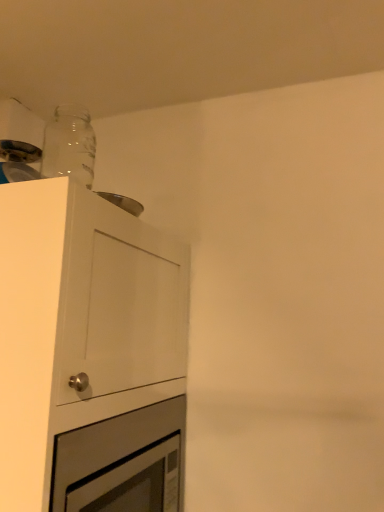
Question: Is the position of white matte cabinet at upper left less distant than that of silver metallic oven at lower left?

Choices:
 (A) no
 (B) yes

Answer: (B)

Question: Is white matte cabinet at upper left further to the viewer compared to silver metallic oven at lower left?

Choices:
 (A) no
 (B) yes

Answer: (A)

Question: Is white matte cabinet at upper left wider than silver metallic oven at lower left?

Choices:
 (A) yes
 (B) no

Answer: (A)

Question: Considering the relative sizes of white matte cabinet at upper left and silver metallic oven at lower left in the image provided, is white matte cabinet at upper left taller than silver metallic oven at lower left?

Choices:
 (A) yes
 (B) no

Answer: (A)

Question: Is the surface of white matte cabinet at upper left in direct contact with silver metallic oven at lower left?

Choices:
 (A) yes
 (B) no

Answer: (B)

Question: In the image, is white matte cabinet at upper left positioned in front of or behind silver metallic oven at lower left?

Choices:
 (A) behind
 (B) front

Answer: (B)

Question: In terms of height, does white matte cabinet at upper left look taller or shorter compared to silver metallic oven at lower left?

Choices:
 (A) short
 (B) tall

Answer: (B)

Question: Is white matte cabinet at upper left to the left or to the right of silver metallic oven at lower left in the image?

Choices:
 (A) left
 (B) right

Answer: (A)

Question: From the image's perspective, is white matte cabinet at upper left located above or below silver metallic oven at lower left?

Choices:
 (A) above
 (B) below

Answer: (A)

Question: Is point (81, 176) closer or farther from the camera than point (127, 453)?

Choices:
 (A) closer
 (B) farther

Answer: (A)

Question: In terms of size, does transparent glass bottle at upper left appear bigger or smaller than silver metallic oven at lower left?

Choices:
 (A) big
 (B) small

Answer: (B)

Question: In the image, is transparent glass bottle at upper left positioned in front of or behind silver metallic oven at lower left?

Choices:
 (A) behind
 (B) front

Answer: (A)

Question: Looking at their shapes, would you say transparent glass bottle at upper left is wider or thinner than silver metallic oven at lower left?

Choices:
 (A) thin
 (B) wide

Answer: (A)

Question: Relative to white matte cabinet at upper left, is silver metallic oven at lower left in front or behind?

Choices:
 (A) front
 (B) behind

Answer: (B)

Question: Is silver metallic oven at lower left situated inside white matte cabinet at upper left or outside?

Choices:
 (A) outside
 (B) inside

Answer: (B)